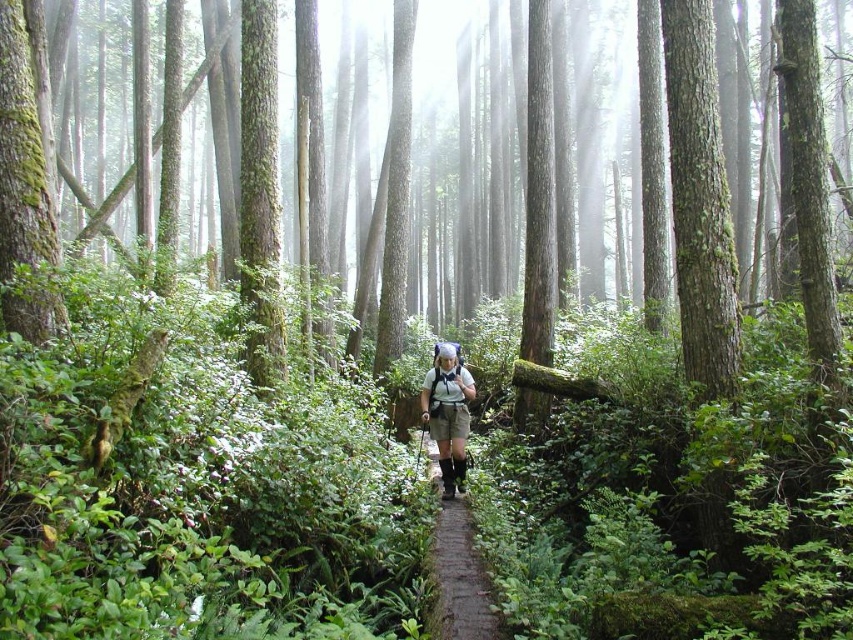
Question: Is brown dirt path at center bigger than khaki fabric shorts at center?

Choices:
 (A) yes
 (B) no

Answer: (B)

Question: Which object appears closest to the camera in this image?

Choices:
 (A) khaki fabric shorts at center
 (B) brown dirt path at center

Answer: (B)

Question: Which point is closer to the camera?

Choices:
 (A) (457, 358)
 (B) (483, 609)

Answer: (B)

Question: Is brown dirt path at center further to the viewer compared to khaki fabric shorts at center?

Choices:
 (A) no
 (B) yes

Answer: (A)

Question: Does brown dirt path at center appear under khaki fabric shorts at center?

Choices:
 (A) yes
 (B) no

Answer: (A)